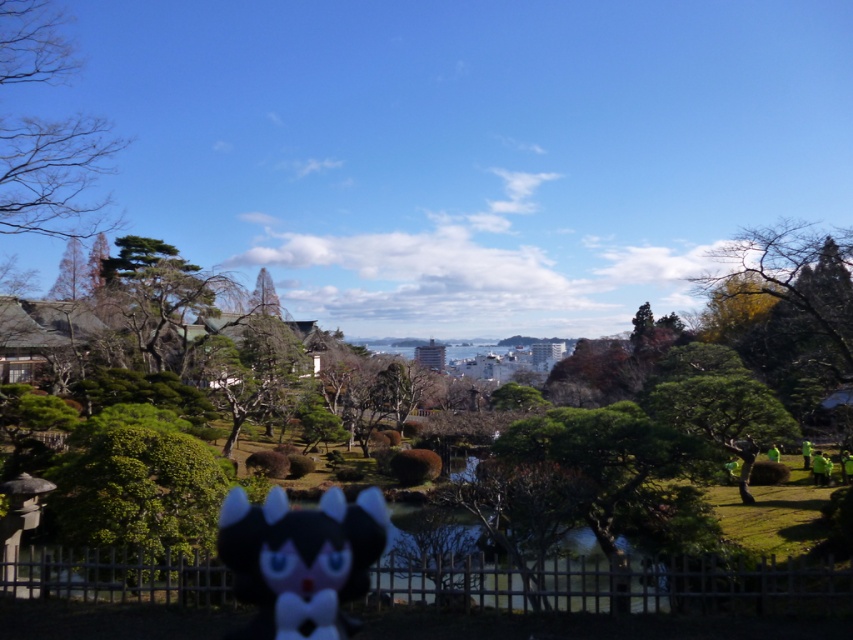
Question: Which object appears farthest from the camera in this image?

Choices:
 (A) green leafy tree at right
 (B) black plush toy at center

Answer: (A)

Question: Does green leafy tree at right appear on the left side of black plush toy at center?

Choices:
 (A) yes
 (B) no

Answer: (B)

Question: From the image, what is the correct spatial relationship of green leafy tree at right in relation to black plush toy at center?

Choices:
 (A) above
 (B) below

Answer: (A)

Question: Is green leafy tree at right further to the viewer compared to black plush toy at center?

Choices:
 (A) yes
 (B) no

Answer: (A)